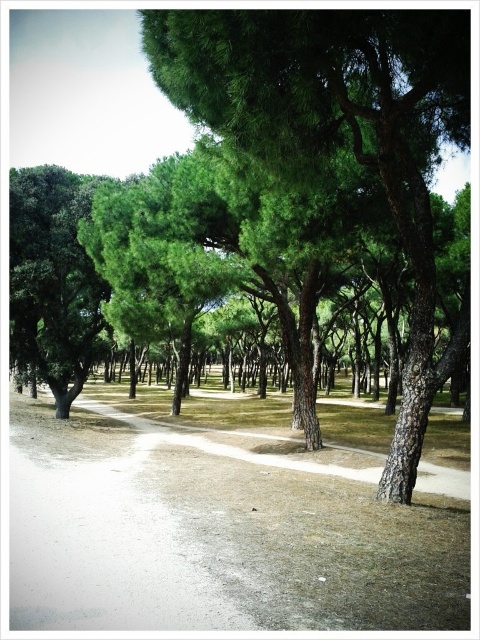
You are a hiker trying to decide which path to take in the forest. You see a dull gray concrete path at center and a dirt path at center. Which path is wider?

The dull gray concrete path at center is bigger than dirt path at center, so the dull gray concrete path at center is wider.

You are a hiker who wants to follow the most traveled path in the forest. You see a dull gray concrete path at center and a dirt path at center. Which path is positioned to the right of the other?

The dull gray concrete path at center is positioned to the right of the dirt path at center.